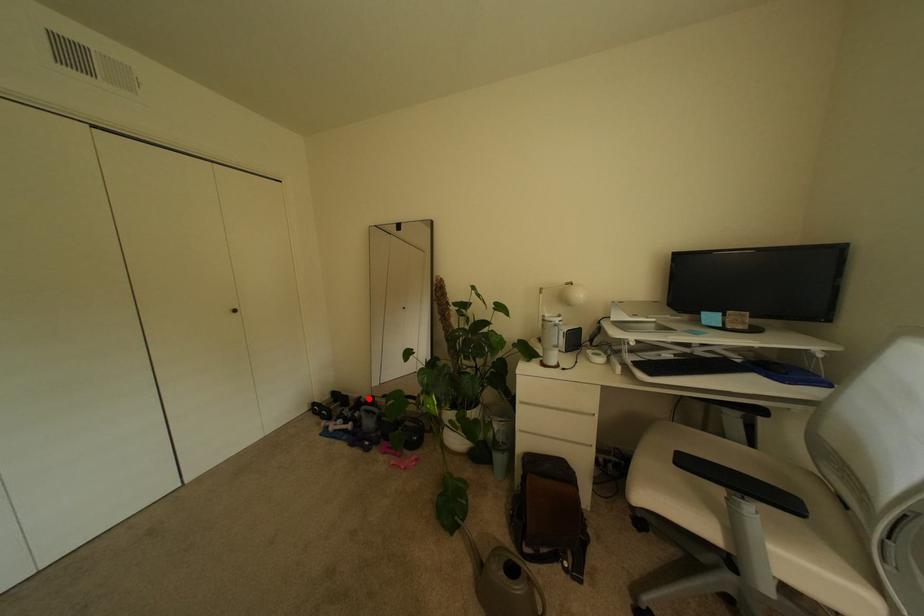
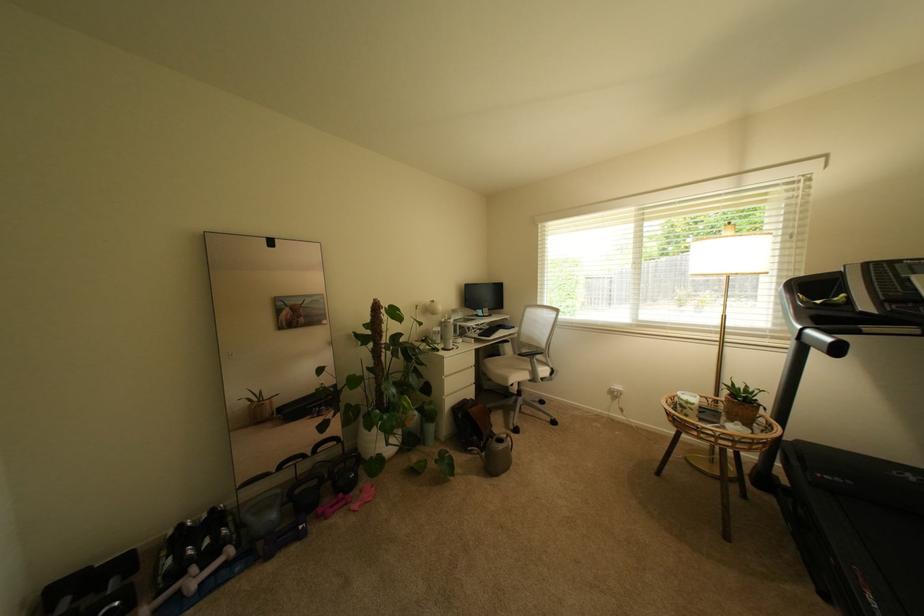
Locate, in the second image, the point that corresponds to the highlighted location in the first image.

(188, 527)